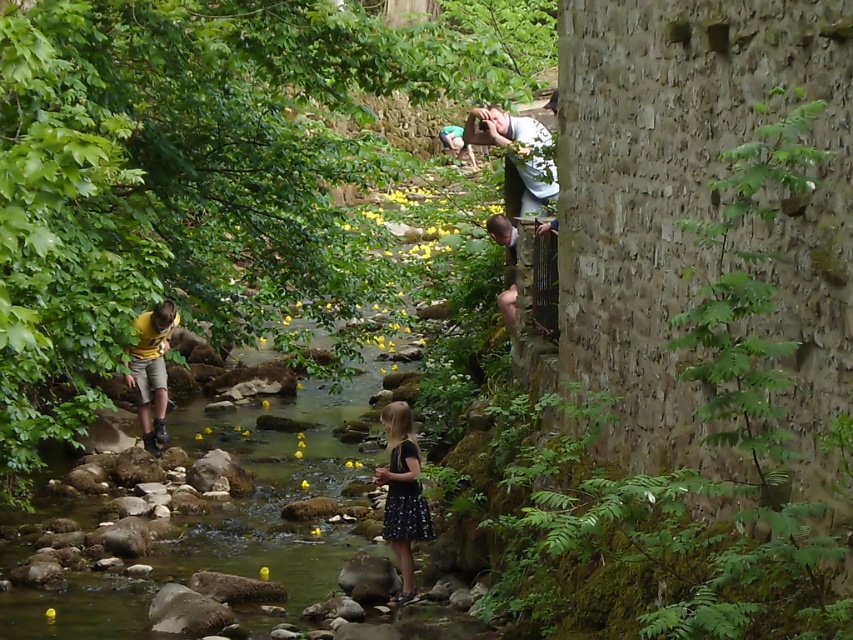
Question: Which point is farther from the camera taking this photo?

Choices:
 (A) (540, 208)
 (B) (155, 436)

Answer: (B)

Question: Does white cotton shirt at upper center have a smaller size compared to yellow matte shorts at center?

Choices:
 (A) no
 (B) yes

Answer: (B)

Question: Based on their relative distances, which object is farther from the white cotton shirt at upper center?

Choices:
 (A) yellow matte shorts at center
 (B) black dotted skirt at center

Answer: (A)

Question: Is black dotted skirt at center thinner than yellow matte shorts at center?

Choices:
 (A) yes
 (B) no

Answer: (A)

Question: Is black dotted skirt at center smaller than yellow matte shorts at center?

Choices:
 (A) yes
 (B) no

Answer: (A)

Question: Estimate the real-world distances between objects in this image. Which object is farther from the white cotton shirt at upper center?

Choices:
 (A) yellow matte shorts at center
 (B) black dotted skirt at center

Answer: (A)